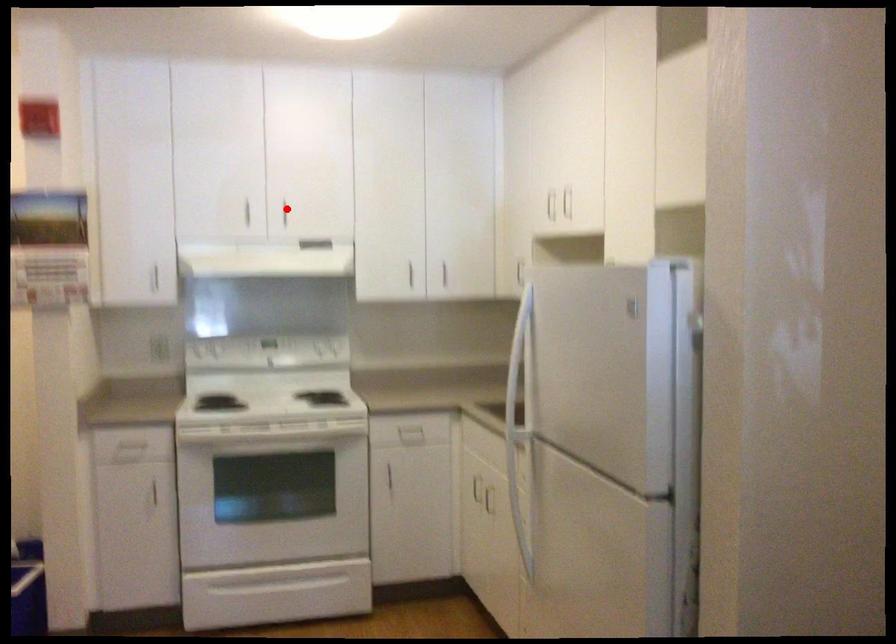
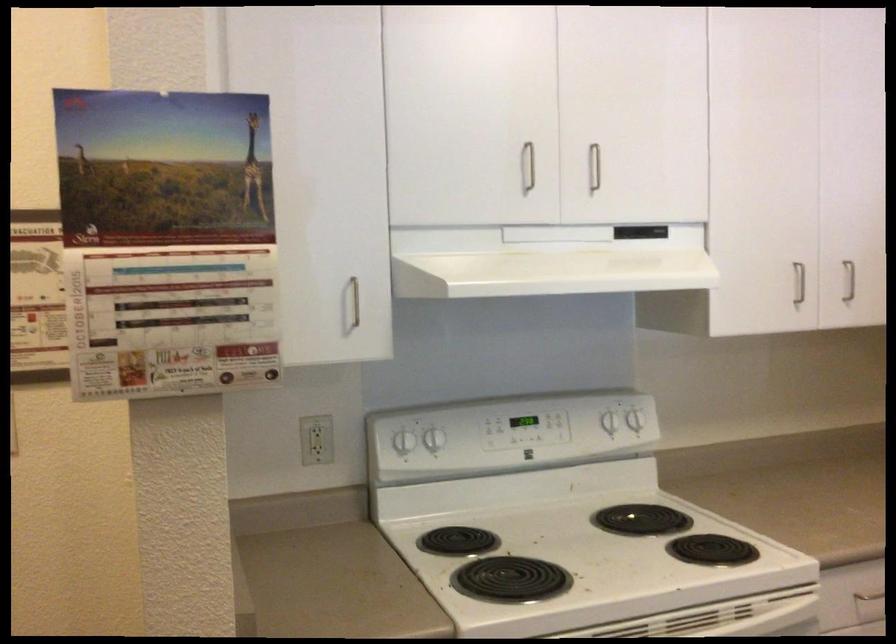
The point at the highlighted location is marked in the first image. Where is the corresponding point in the second image?

(593, 167)